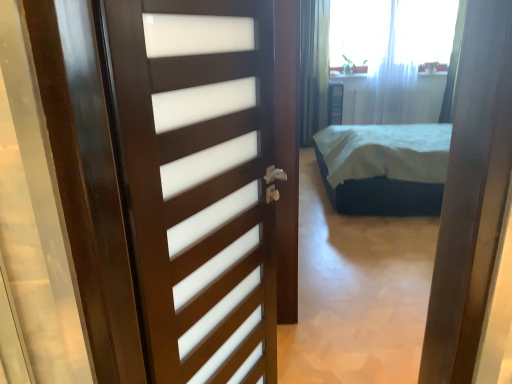
Question: Is dark blue fabric bed at center not within white sheer curtain at upper center, placed as the second curtain when sorted from right to left?

Choices:
 (A) no
 (B) yes

Answer: (B)

Question: Is dark blue fabric bed at center next to white sheer curtain at upper center, arranged as the first curtain when viewed from the left?

Choices:
 (A) yes
 (B) no

Answer: (B)

Question: Does dark blue fabric bed at center have a lesser width compared to white sheer curtain at upper center, arranged as the first curtain when viewed from the left?

Choices:
 (A) no
 (B) yes

Answer: (A)

Question: Does dark blue fabric bed at center appear on the left side of white sheer curtain at upper center, placed as the second curtain when sorted from right to left?

Choices:
 (A) yes
 (B) no

Answer: (A)

Question: Can you confirm if dark blue fabric bed at center is smaller than white sheer curtain at upper center, placed as the second curtain when sorted from right to left?

Choices:
 (A) no
 (B) yes

Answer: (A)

Question: Is dark blue fabric bed at center bigger than white sheer curtain at upper center, placed as the second curtain when sorted from right to left?

Choices:
 (A) yes
 (B) no

Answer: (A)

Question: From a real-world perspective, is white sheer curtain at upper center, arranged as the first curtain when viewed from the left, below dark blue fabric bed at center?

Choices:
 (A) no
 (B) yes

Answer: (A)

Question: Can you confirm if white sheer curtain at upper center, arranged as the first curtain when viewed from the left, is thinner than dark blue fabric bed at center?

Choices:
 (A) no
 (B) yes

Answer: (B)

Question: Does white sheer curtain at upper center, arranged as the first curtain when viewed from the left, have a greater height compared to dark blue fabric bed at center?

Choices:
 (A) yes
 (B) no

Answer: (A)

Question: From the image's perspective, is white sheer curtain at upper center, placed as the second curtain when sorted from right to left, over dark blue fabric bed at center?

Choices:
 (A) no
 (B) yes

Answer: (B)

Question: Is white sheer curtain at upper center, arranged as the first curtain when viewed from the left, touching dark blue fabric bed at center?

Choices:
 (A) no
 (B) yes

Answer: (A)

Question: Is white sheer curtain at upper center, arranged as the first curtain when viewed from the left, outside dark blue fabric bed at center?

Choices:
 (A) no
 (B) yes

Answer: (B)

Question: Is white sheer curtain at upper center taller than white sheer curtain at upper center, placed as the second curtain when sorted from right to left?

Choices:
 (A) yes
 (B) no

Answer: (B)